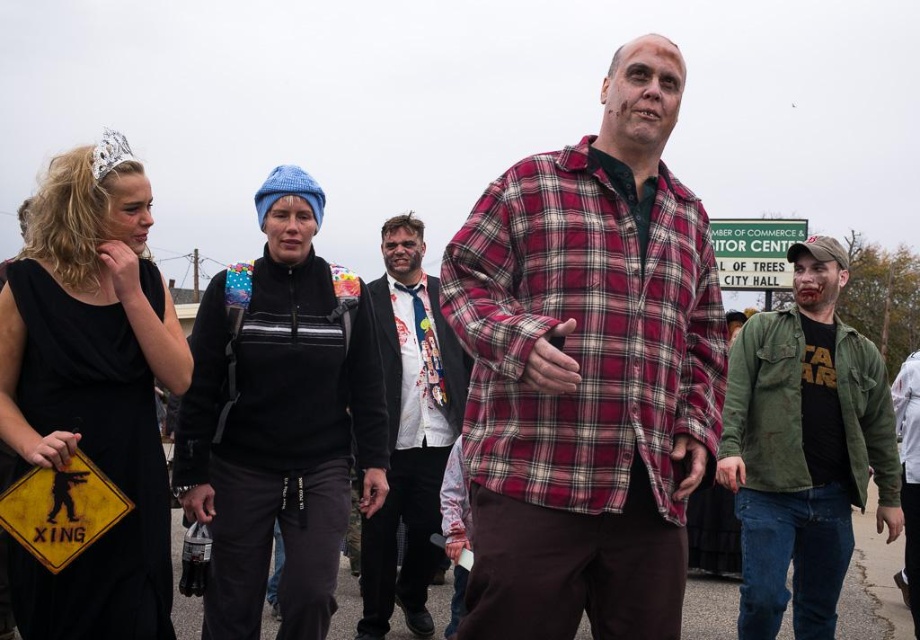
You are a photographer trying to capture a photo of the white printed shirt at center and the green plastic sign at upper center. Which object should you focus on first if you want to include both in the frame without moving the camera?

The white printed shirt at center is taller than the green plastic sign at upper center, so you should focus on the white printed shirt at center first to ensure both fit in the frame.